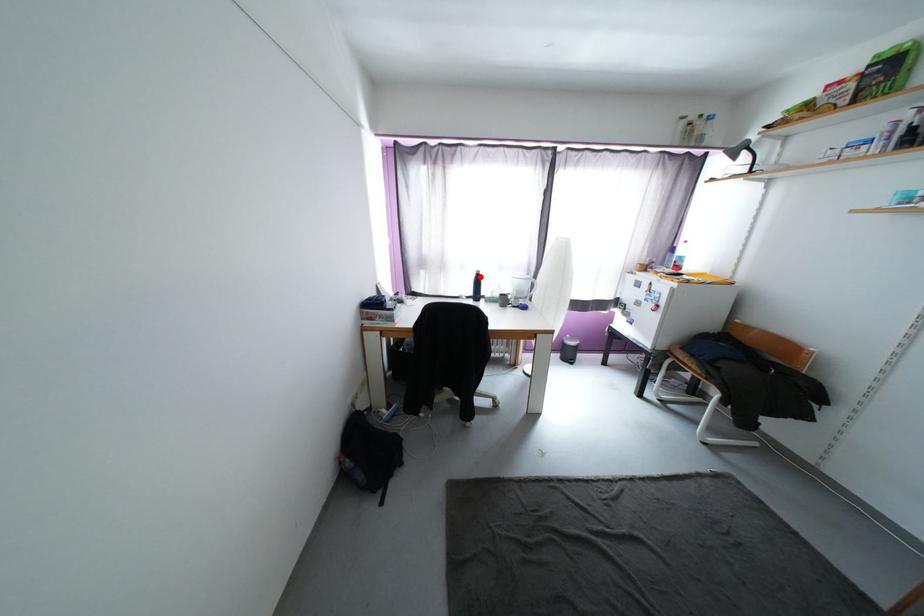
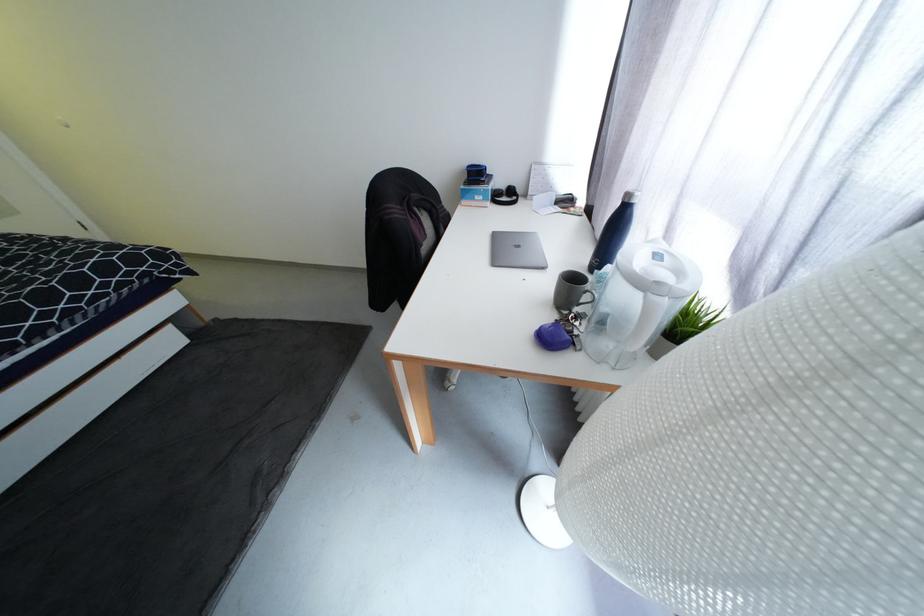
Question: A red point is marked in image1. In image2, is the corresponding 3D point closer to the camera or farther? Reply with the corresponding letter.

Choices:
 (A) The corresponding 3D point is closer.
 (B) The corresponding 3D point is farther.

Answer: (A)